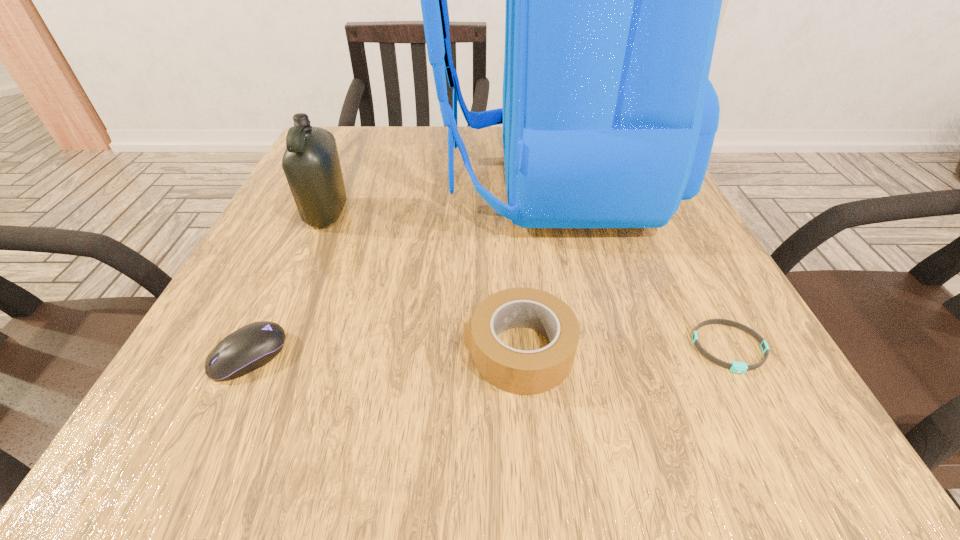
Locate an element on the screen. the tallest object is located at coordinates (613, 0).

Where is `the second tallest object`? the second tallest object is located at coordinates (311, 164).

You are a GUI agent. You are given a task and a screenshot of the screen. Output one action in this format:
    pyautogui.click(x=<x>, y=<y>)
    Task: Click on the duct tape
    Image resolution: width=960 pixels, height=540 pixels.
    Given the screenshot: What is the action you would take?
    pyautogui.click(x=516, y=371)

Identify the location of the fourth tallest object. (252, 346).

At what (x,y) coordinates should I click in order to perform the action: click on the shortest object. Please return your answer as a coordinate pair (x, y). This screenshot has height=540, width=960. Looking at the image, I should click on (737, 367).

The height and width of the screenshot is (540, 960). What are the coordinates of `vacant space positioned 0.050m on the back of the backpack` in the screenshot? It's located at (410, 184).

Image resolution: width=960 pixels, height=540 pixels. Find the location of `vacant position located on the back of the backpack`. vacant position located on the back of the backpack is located at coordinates (342, 184).

This screenshot has height=540, width=960. Find the location of `vacant space located on the back of the backpack`. vacant space located on the back of the backpack is located at coordinates (351, 184).

Identify the location of vacant space situated 0.210m on the front of the bottle. This screenshot has height=540, width=960. (278, 323).

You are a GUI agent. You are given a task and a screenshot of the screen. Output one action in this format:
    pyautogui.click(x=<x>, y=<y>)
    Task: Click on the vacant space situated 0.270m at the edge of the third tallest object
    This screenshot has width=960, height=540.
    Given the screenshot: What is the action you would take?
    pyautogui.click(x=262, y=350)